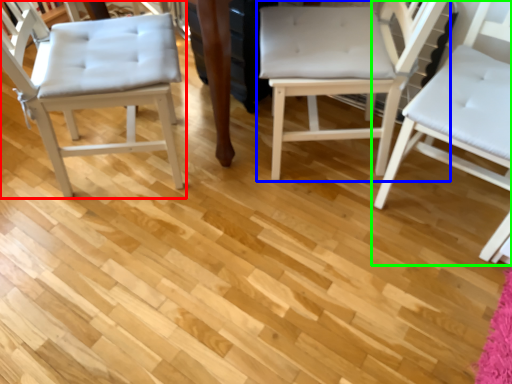
Question: Considering the real-world distances, which object is farthest from chair (highlighted by a red box)? chair (highlighted by a blue box) or chair (highlighted by a green box)?

Choices:
 (A) chair
 (B) chair

Answer: (B)